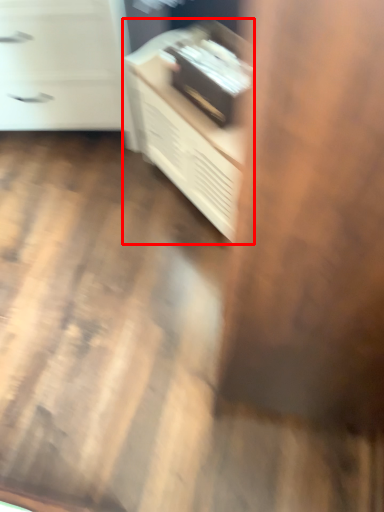
Question: From the image's perspective, where is furniture (annotated by the red box) located in relation to chest of drawers in the image?

Choices:
 (A) above
 (B) below

Answer: (B)